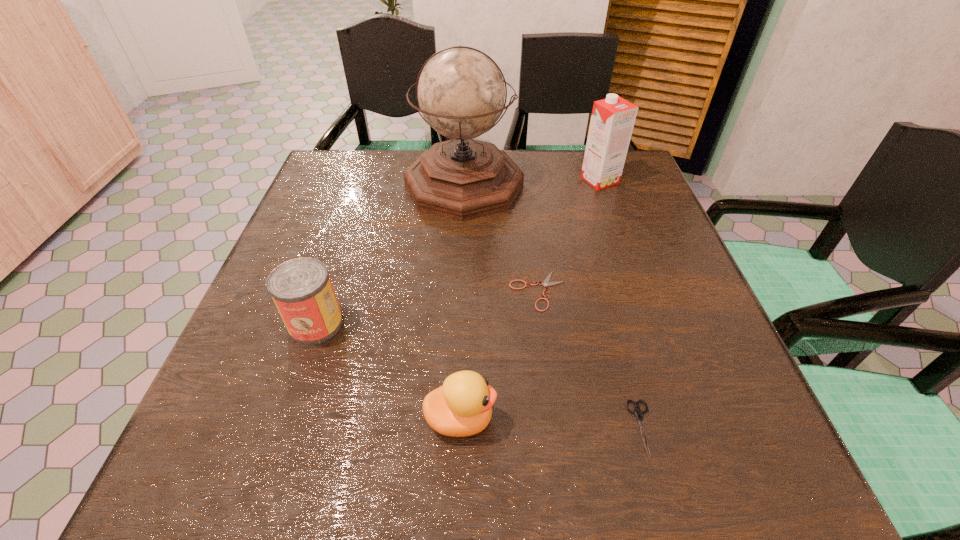
At what (x,y) coordinates should I click in order to perform the action: click on the tallest object. Please return your answer as a coordinate pair (x, y). The height and width of the screenshot is (540, 960). Looking at the image, I should click on (461, 92).

Identify the location of the rightmost object. This screenshot has width=960, height=540. (612, 120).

What are the coordinates of `carton` in the screenshot? It's located at (612, 120).

Locate an element on the screen. the leftmost object is located at coordinates (301, 288).

You are a GUI agent. You are given a task and a screenshot of the screen. Output one action in this format:
    pyautogui.click(x=<x>, y=<y>)
    Task: Click on the duckling
    
    Given the screenshot: What is the action you would take?
    pyautogui.click(x=462, y=407)

This screenshot has height=540, width=960. I want to click on the nearer shears, so click(637, 411).

Find the location of `the right shears`. the right shears is located at coordinates (637, 411).

Where is `the shortest object`? The width and height of the screenshot is (960, 540). the shortest object is located at coordinates (546, 282).

Locate an element on the screen. the shorter shears is located at coordinates (546, 282).

Identify the location of vacant space located on the surface of the tallest object. (459, 305).